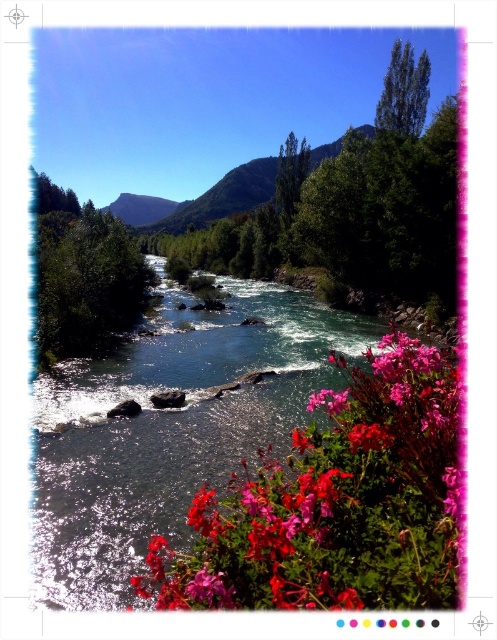
Is vivid pink petals at lower right smaller than green forested mountain at upper center?

Yes, vivid pink petals at lower right is smaller than green forested mountain at upper center.

Between vivid pink petals at lower right and green forested mountain at upper center, which one has more height?

green forested mountain at upper center

Which is in front, point (301, 579) or point (251, 179)?

Point (301, 579)

In order to click on vivid pink petals at lower right in this screenshot , I will do point(336,502).